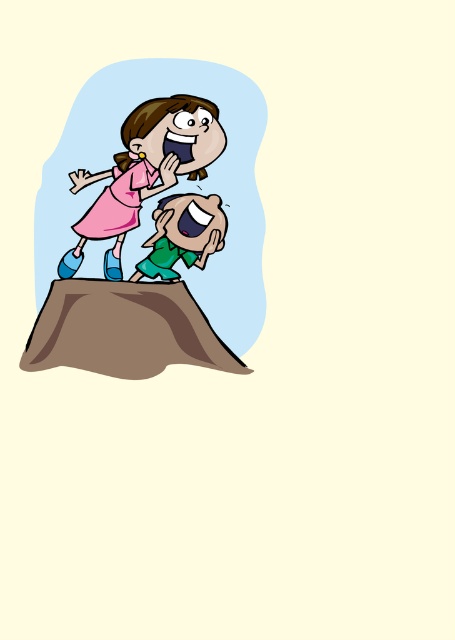
Question: Can you confirm if pink fabric dress at upper center is bigger than pink matte dress at upper center?

Choices:
 (A) no
 (B) yes

Answer: (B)

Question: Which object is farther from the camera taking this photo?

Choices:
 (A) pink matte dress at upper center
 (B) pink fabric dress at upper center

Answer: (A)

Question: Can you confirm if pink fabric dress at upper center is thinner than pink matte dress at upper center?

Choices:
 (A) no
 (B) yes

Answer: (A)

Question: Is pink fabric dress at upper center above pink matte dress at upper center?

Choices:
 (A) no
 (B) yes

Answer: (A)

Question: Which object appears farthest from the camera in this image?

Choices:
 (A) pink matte dress at upper center
 (B) pink fabric dress at upper center

Answer: (A)